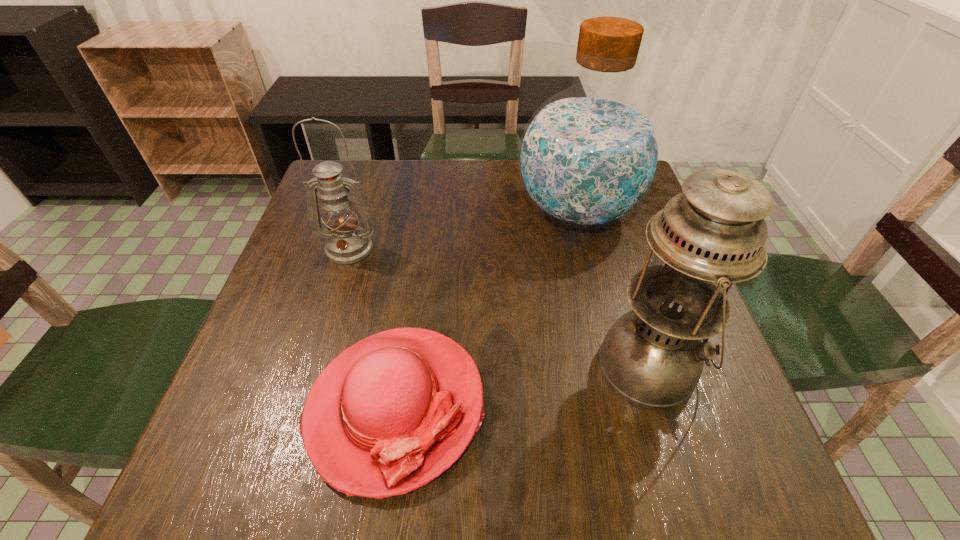
Identify the location of water jug. The height and width of the screenshot is (540, 960). (589, 155).

You are a GUI agent. You are given a task and a screenshot of the screen. Output one action in this format:
    pyautogui.click(x=<x>, y=<y>)
    Task: Click on the taller oil lamp
    The image size is (960, 540).
    Given the screenshot: What is the action you would take?
    (x=712, y=235)

You are a GUI agent. You are given a task and a screenshot of the screen. Output one action in this format:
    pyautogui.click(x=<x>, y=<y>)
    Task: Click on the nearer oil lamp
    
    Given the screenshot: What is the action you would take?
    pyautogui.click(x=712, y=235)

Where is `the shorter oil lamp`? the shorter oil lamp is located at coordinates (346, 243).

The height and width of the screenshot is (540, 960). I want to click on the left oil lamp, so click(x=346, y=243).

Find the location of a particular element. hat is located at coordinates (389, 414).

At what (x,y) coordinates should I click in order to perform the action: click on vacant space situated 0.250m on the front of the water jug. Please return your answer as a coordinate pair (x, y). Looking at the image, I should click on (609, 340).

Image resolution: width=960 pixels, height=540 pixels. I want to click on free spot located on the left of the taller oil lamp, so click(488, 366).

Identify the location of vacant region located on the left of the farther oil lamp. This screenshot has width=960, height=540. pos(290,248).

Find the location of a particular element. The width and height of the screenshot is (960, 540). object located in the far edge section of the desktop is located at coordinates (589, 155).